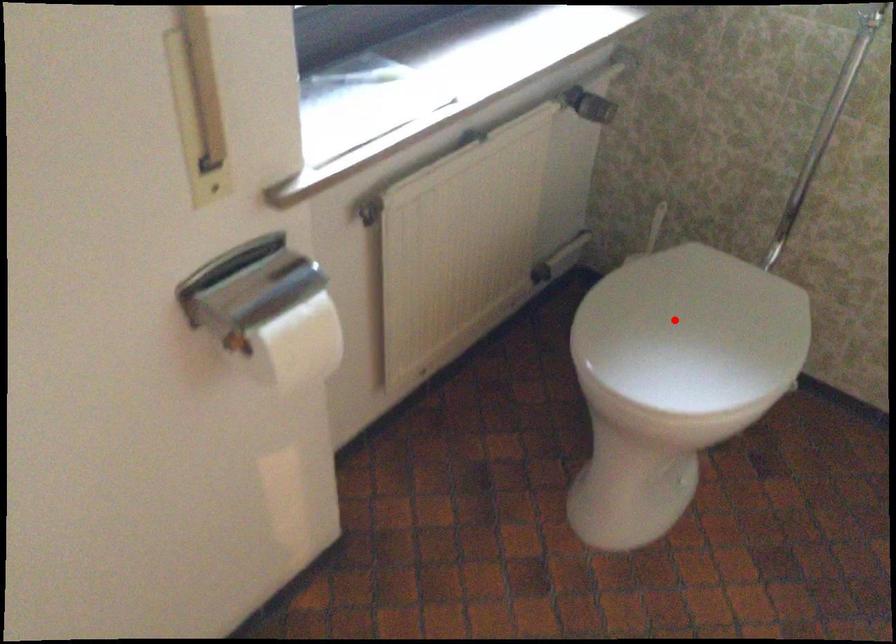
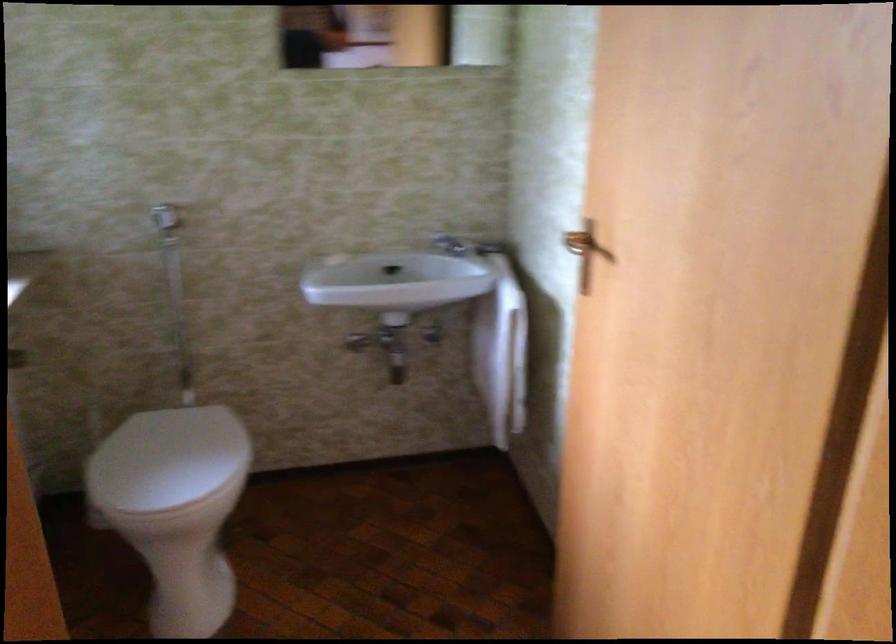
In the second image, find the point that corresponds to the highlighted location in the first image.

(167, 460)